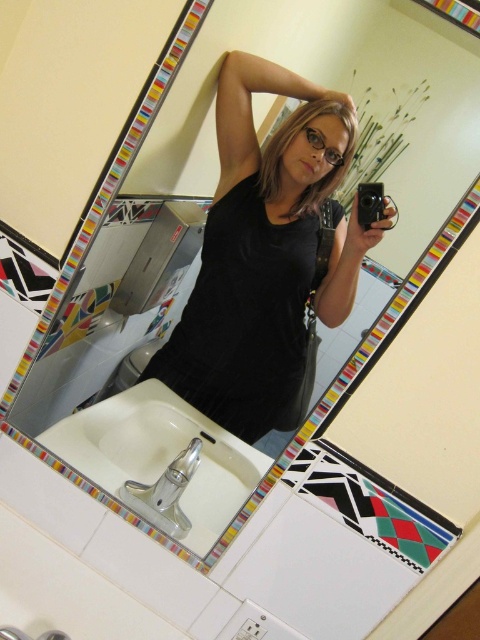
Based on the scene description, where is the black matte tank top at center positioned in relation to the mirror and the person?

The black matte tank top at center is located at point coordinates [256,250], which places it in the lower central area of the mirror reflection.

From the picture: You are a photographer trying to capture the reflection in the mirror. You notice the black matte tank top at center and the white ceramic sink at lower left. Which object is closer to the camera lens?

The black matte tank top at center is closer to the camera lens because the white ceramic sink at lower left is behind it.

You are a photographer analyzing the image. The point at coordinates [256,250] is marked. What object in the scene is located at that point?

The point at coordinates [256,250] corresponds to the black matte tank top at center.